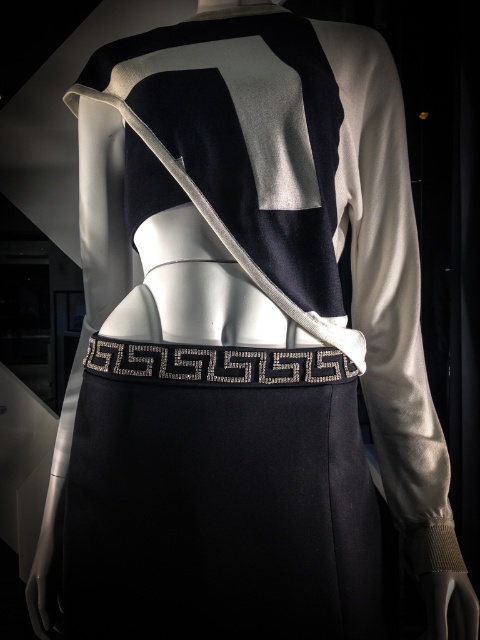
Is point (178, 356) positioned after point (300, 355)?

No, (178, 356) is in front of (300, 355).

Is black satin apron at center shorter than silver metallic belt at center?

No.

I want to click on black satin apron at center, so click(218, 497).

What are the coordinates of `black satin apron at center` in the screenshot? It's located at (218, 497).